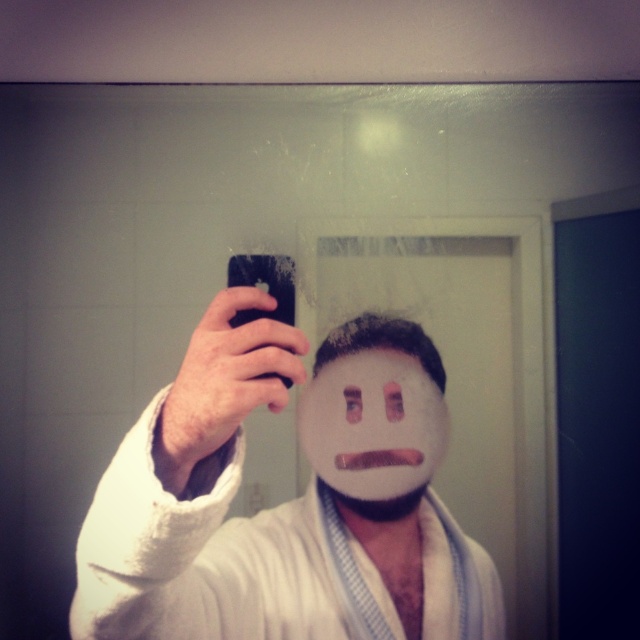
You are a photographer setting up a shoot in this bathroom. You need to place a small tripod between the white towel at center and the white matte mask at center. Based on their positions, where should you place the tripod?

The white towel at center is located below the white matte mask at center, so you should place the tripod between them in the vertical space between the white towel at center and white matte mask at center.